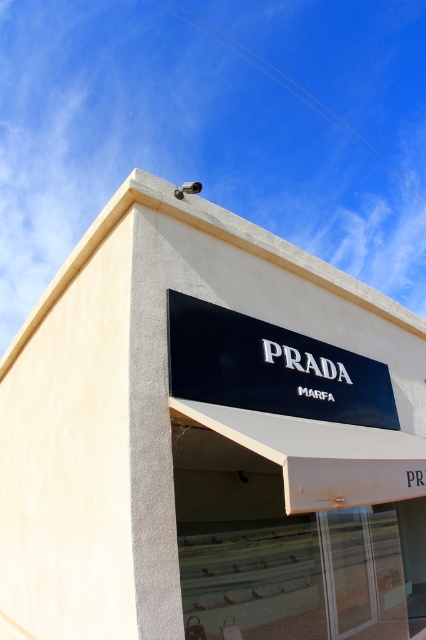
Which is in front, point (184, 468) or point (273, 403)?

Point (273, 403)

Based on the photo, is black matte sign at center thinner than black glossy sign at center?

Correct, black matte sign at center's width is less than black glossy sign at center's.

Identify the location of black matte sign at center. (210, 440).

Find the location of a particular element. black matte sign at center is located at coordinates (210, 440).